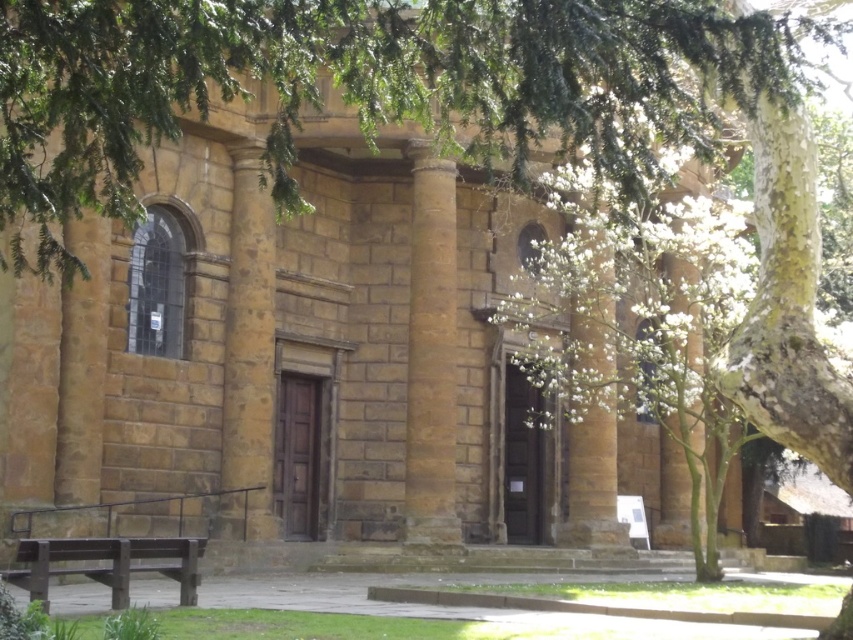
Question: Which point is closer to the camera taking this photo?

Choices:
 (A) (244, 45)
 (B) (190, 572)
 (C) (454, 166)

Answer: (A)

Question: Which object appears farthest from the camera in this image?

Choices:
 (A) brown stone column at center
 (B) green leafy branches at upper center

Answer: (A)

Question: Is green leafy branches at upper center further to the viewer compared to brown wooden bench at lower left?

Choices:
 (A) yes
 (B) no

Answer: (B)

Question: Is green leafy branches at upper center above brown stone column at center?

Choices:
 (A) yes
 (B) no

Answer: (A)

Question: Can you confirm if brown stone column at center is wider than brown wooden bench at lower left?

Choices:
 (A) yes
 (B) no

Answer: (B)

Question: Among these objects, which one is farthest from the camera?

Choices:
 (A) brown stone column at center
 (B) brown wooden bench at lower left

Answer: (A)